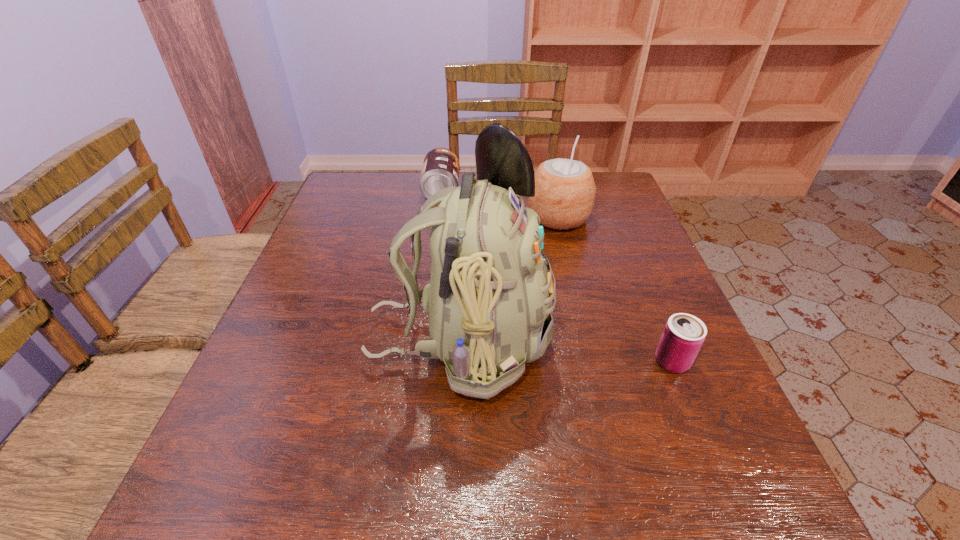
Locate an element on the screen. This screenshot has width=960, height=540. vacant region that satisfies the following two spatial constraints: 1. on the back side of the third shortest object; 2. on the front label of the left can is located at coordinates (552, 191).

Where is `vacant space that satisfies the following two spatial constraints: 1. on the front side of the third shortest object; 2. on the left side of the right can`? vacant space that satisfies the following two spatial constraints: 1. on the front side of the third shortest object; 2. on the left side of the right can is located at coordinates (592, 362).

In order to click on vacant space that satisfies the following two spatial constraints: 1. on the front-facing side of the backpack; 2. on the back side of the nearer can in this screenshot , I will do `click(458, 362)`.